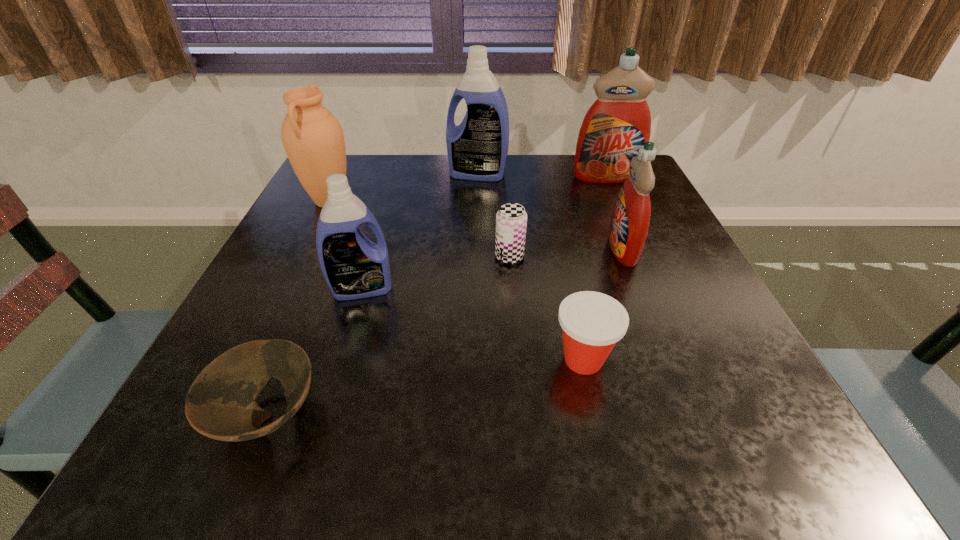
You are a GUI agent. You are given a task and a screenshot of the screen. Output one action in this format:
    pyautogui.click(x=<x>, y=<y>)
    Task: Click on the object that is at the far right corner
    This screenshot has height=540, width=960.
    Given the screenshot: What is the action you would take?
    pyautogui.click(x=618, y=123)

In the image, there is a desktop. What are the coordinates of `free space at the far edge` in the screenshot? It's located at (519, 163).

This screenshot has height=540, width=960. In order to click on vacant position at the near edge of the desktop in this screenshot , I will do 558,441.

Locate an element on the screen. The height and width of the screenshot is (540, 960). vacant space at the left edge of the desktop is located at coordinates (314, 336).

The height and width of the screenshot is (540, 960). I want to click on blank space at the right edge of the desktop, so click(x=627, y=283).

Where is `vacant region at the far left corner of the desktop`? Image resolution: width=960 pixels, height=540 pixels. vacant region at the far left corner of the desktop is located at coordinates (369, 174).

You are a GUI agent. You are given a task and a screenshot of the screen. Output one action in this format:
    pyautogui.click(x=<x>, y=<y>)
    Task: Click on the vacant space at the near left corner of the desktop
    
    Given the screenshot: What is the action you would take?
    pyautogui.click(x=164, y=447)

This screenshot has width=960, height=540. I want to click on vacant space at the far right corner of the desktop, so click(x=599, y=184).

The height and width of the screenshot is (540, 960). What are the coordinates of `vacant area that lies between the Dixie cup and the purple beer can` in the screenshot? It's located at (546, 308).

Where is `vacant area that lies between the red-orange Dixie cup and the smaller blue detergent`? vacant area that lies between the red-orange Dixie cup and the smaller blue detergent is located at coordinates (472, 324).